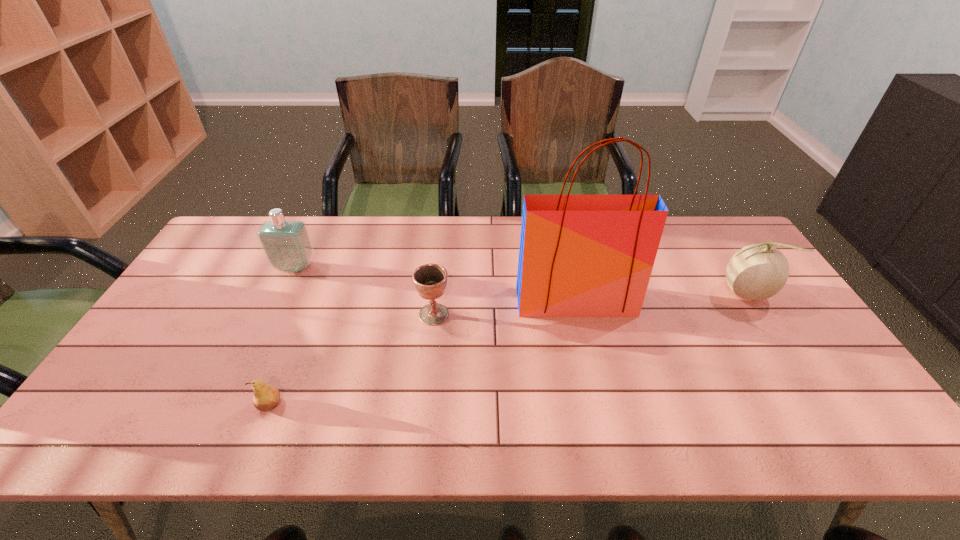
Where is `the second object from right to left`? the second object from right to left is located at coordinates (580, 255).

Locate an element on the screen. This screenshot has width=960, height=540. shopping bag is located at coordinates (580, 255).

Identify the location of cantaloup. (757, 272).

This screenshot has height=540, width=960. What are the coordinates of `the leftmost object` in the screenshot? It's located at (286, 244).

You are a GUI agent. You are given a task and a screenshot of the screen. Output one action in this format:
    pyautogui.click(x=<x>, y=<y>)
    Task: Click on the farthest object
    
    Given the screenshot: What is the action you would take?
    pyautogui.click(x=286, y=244)

The height and width of the screenshot is (540, 960). Find the location of `the fourth tallest object`. the fourth tallest object is located at coordinates (430, 280).

The height and width of the screenshot is (540, 960). In order to click on chalice in this screenshot , I will do `click(430, 280)`.

Locate an element on the screen. Image resolution: width=960 pixels, height=540 pixels. pear is located at coordinates (266, 397).

The height and width of the screenshot is (540, 960). Find the location of `the shortest object`. the shortest object is located at coordinates (266, 397).

Locate an element on the screen. vacant area located 0.070m on the handle side of the second object from right to left is located at coordinates (584, 338).